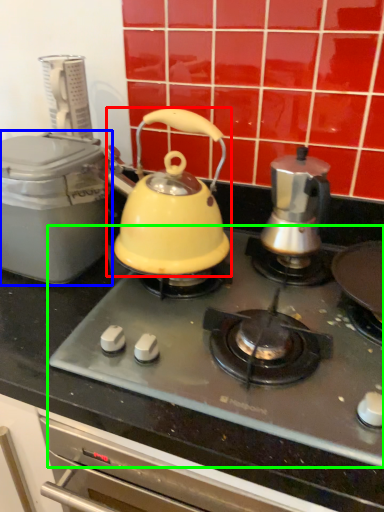
Question: Which object is positioned closest to kettle (highlighted by a red box)? Select from kitchen appliance (highlighted by a blue box) and gas stove (highlighted by a green box).

Choices:
 (A) kitchen appliance
 (B) gas stove

Answer: (A)